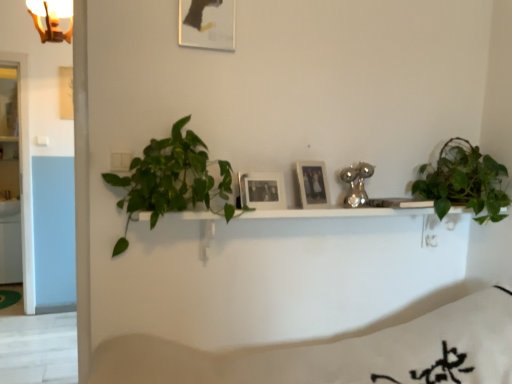
Question: Is matte black picture frame at upper center, the third picture frame when ordered from bottom to top, further to camera compared to green matte plant at upper right, acting as the first houseplant starting from the right?

Choices:
 (A) no
 (B) yes

Answer: (A)

Question: Are matte black picture frame at upper center, the first picture frame viewed from the left, and green matte plant at upper right, placed as the 2th houseplant when sorted from left to right, located far from each other?

Choices:
 (A) yes
 (B) no

Answer: (A)

Question: From the image's perspective, is matte black picture frame at upper center, marked as the third picture frame in a right-to-left arrangement, beneath green matte plant at upper right, placed as the 2th houseplant when sorted from left to right?

Choices:
 (A) no
 (B) yes

Answer: (A)

Question: Considering the relative sizes of matte black picture frame at upper center, marked as the third picture frame in a right-to-left arrangement, and green matte plant at upper right, placed as the 2th houseplant when sorted from left to right, in the image provided, is matte black picture frame at upper center, marked as the third picture frame in a right-to-left arrangement, smaller than green matte plant at upper right, placed as the 2th houseplant when sorted from left to right,?

Choices:
 (A) yes
 (B) no

Answer: (A)

Question: Considering the relative positions of matte black picture frame at upper center, the 1th picture frame positioned from the top, and green matte plant at upper right, placed as the 2th houseplant when sorted from left to right, in the image provided, is matte black picture frame at upper center, the 1th picture frame positioned from the top, to the left of green matte plant at upper right, placed as the 2th houseplant when sorted from left to right, from the viewer's perspective?

Choices:
 (A) no
 (B) yes

Answer: (B)

Question: Is black matte picture frame at center, the 3th picture frame when ordered from top to bottom, inside the boundaries of green leafy plant at left, which ranks as the second houseplant in right-to-left order, or outside?

Choices:
 (A) inside
 (B) outside

Answer: (A)

Question: From a real-world perspective, relative to green leafy plant at left, which ranks as the second houseplant in right-to-left order, is black matte picture frame at center, the 3th picture frame when ordered from top to bottom, vertically above or below?

Choices:
 (A) above
 (B) below

Answer: (A)

Question: Does point (269, 193) appear closer or farther from the camera than point (197, 147)?

Choices:
 (A) closer
 (B) farther

Answer: (B)

Question: In terms of height, does black matte picture frame at center, which is counted as the 2th picture frame, starting from the right, look taller or shorter compared to green leafy plant at left, which ranks as the second houseplant in right-to-left order?

Choices:
 (A) tall
 (B) short

Answer: (B)

Question: From the image's perspective, relative to white matte bedding at lower center, is green leafy plant at left, marked as the first houseplant in a left-to-right arrangement, above or below?

Choices:
 (A) below
 (B) above

Answer: (B)

Question: Is point (181, 157) closer or farther from the camera than point (174, 352)?

Choices:
 (A) closer
 (B) farther

Answer: (A)

Question: From their relative heights in the image, would you say green leafy plant at left, marked as the first houseplant in a left-to-right arrangement, is taller or shorter than white matte bedding at lower center?

Choices:
 (A) tall
 (B) short

Answer: (B)

Question: Is green leafy plant at left, marked as the first houseplant in a left-to-right arrangement, inside the boundaries of white matte bedding at lower center, or outside?

Choices:
 (A) outside
 (B) inside

Answer: (A)

Question: Is point (441, 170) positioned closer to the camera than point (208, 205)?

Choices:
 (A) closer
 (B) farther

Answer: (B)

Question: Which is correct: green matte plant at upper right, acting as the first houseplant starting from the right, is inside green leafy plant at left, which ranks as the second houseplant in right-to-left order, or outside of it?

Choices:
 (A) inside
 (B) outside

Answer: (B)